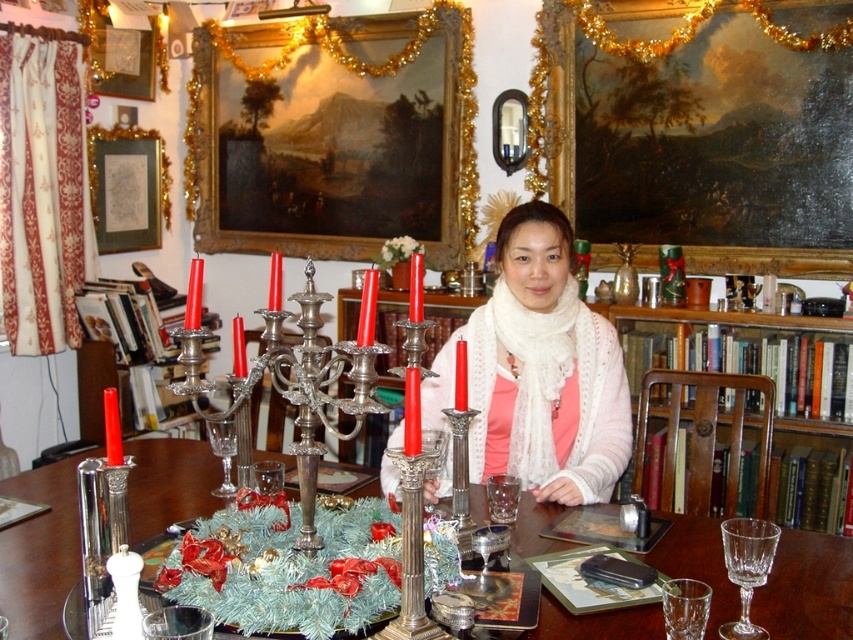
You are standing in the dining room and want to place a small decoration between the two points, point 1 at [656,554] and point 2 at [563,484]. Which point should you move towards to ensure the decoration is closer to the camera?

To place the decoration closer to the camera, you should move towards point 1 at [656,554] because it is in front of point 2 at [563,484].